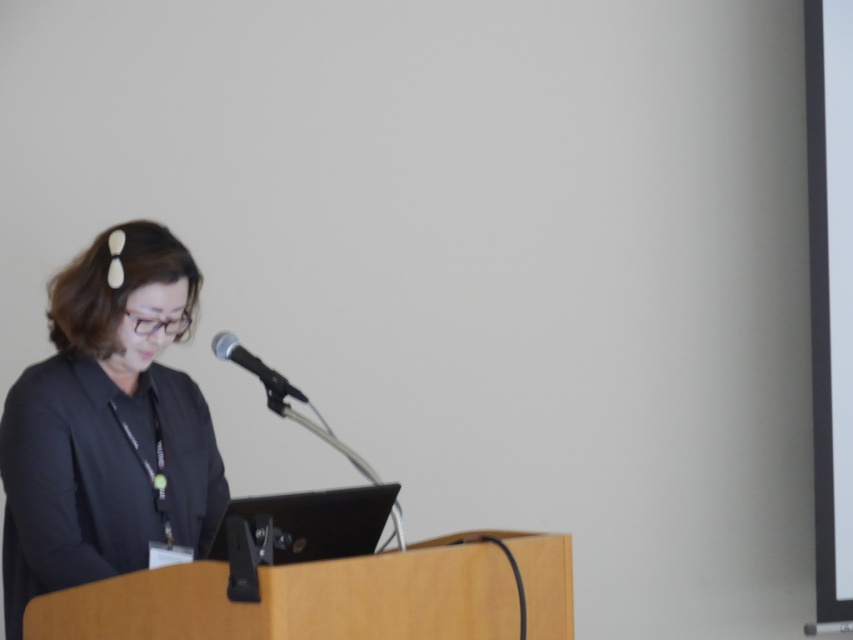
Question: Considering the relative positions of black matte blazer at left and black metallic microphone at center in the image provided, where is black matte blazer at left located with respect to black metallic microphone at center?

Choices:
 (A) right
 (B) left

Answer: (B)

Question: Is black matte blazer at left above black metallic microphone at center?

Choices:
 (A) yes
 (B) no

Answer: (B)

Question: Which object is closer to the camera taking this photo?

Choices:
 (A) black metallic microphone at center
 (B) black matte blazer at left

Answer: (B)

Question: Is black matte blazer at left bigger than black metallic microphone at center?

Choices:
 (A) no
 (B) yes

Answer: (B)